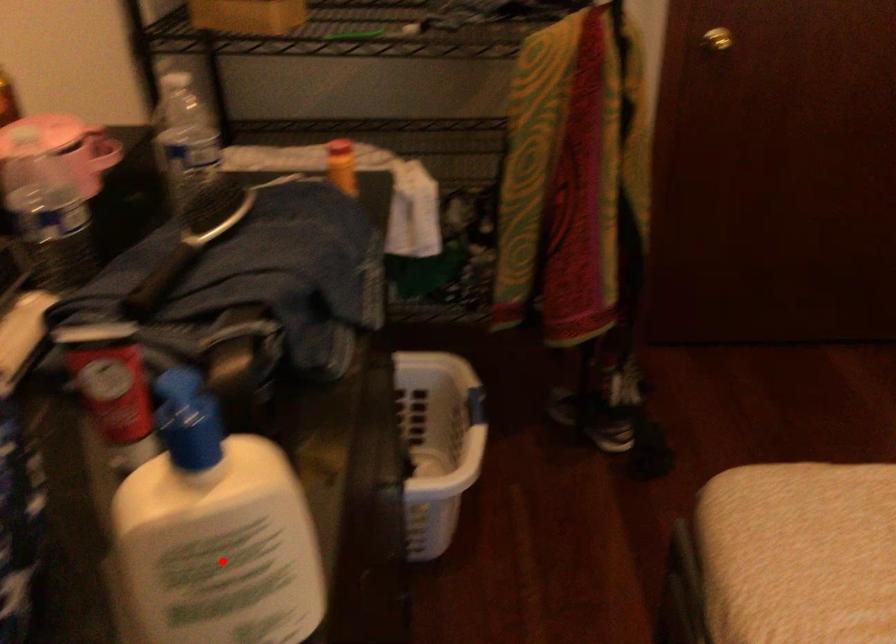
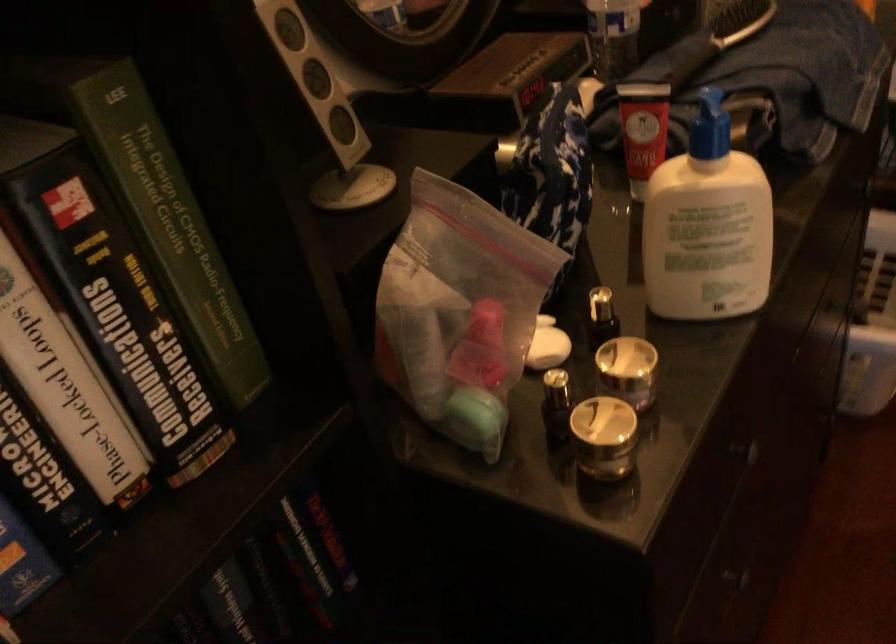
Question: I am providing you with two images of the same scene from different viewpoints. A red point is marked on the first image. Is the red point's position out of view in image 2?

Choices:
 (A) Yes
 (B) No

Answer: (B)